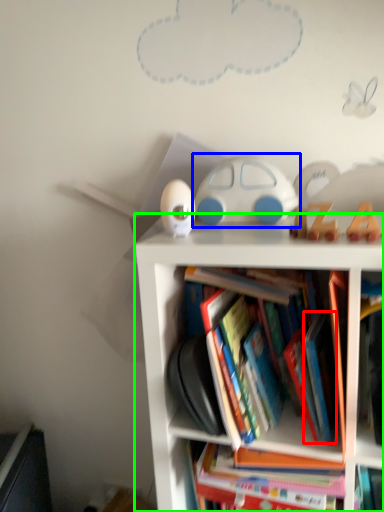
Question: Which object is positioned farthest from paperback book (highlighted by a red box)? Select from toy (highlighted by a blue box) and bookcase (highlighted by a green box).

Choices:
 (A) toy
 (B) bookcase

Answer: (A)